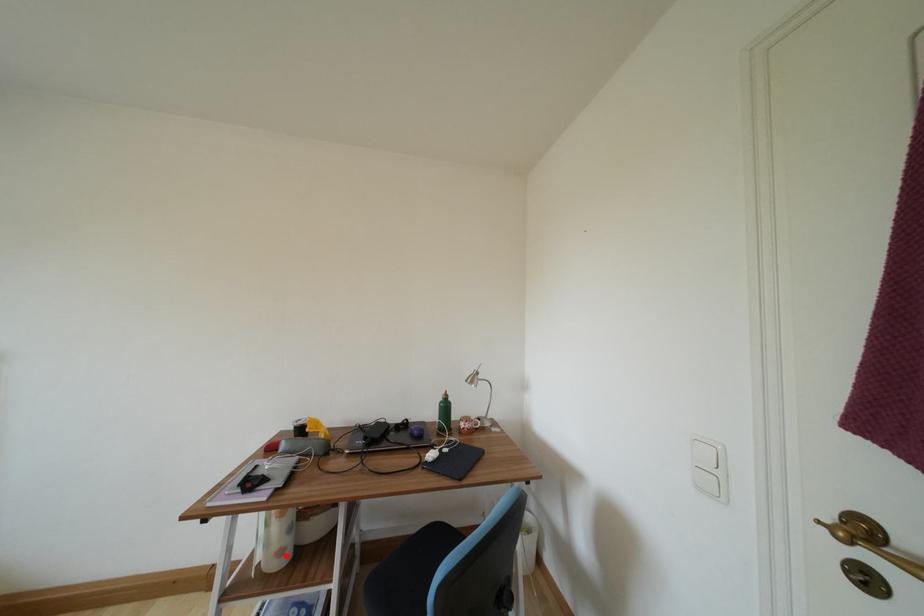
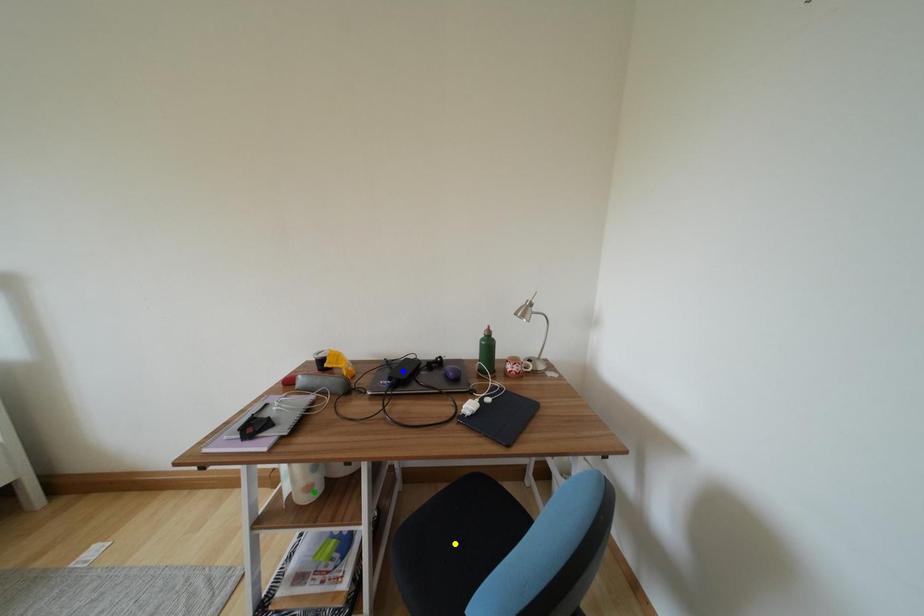
Question: I am providing you with two images of the same scene from different viewpoints. A red point is marked on the first image. You are given multiple points on the second image. Can you choose the point in image 2 that corresponds to the point in image 1?

Choices:
 (A) green point
 (B) yellow point
 (C) blue point

Answer: (A)